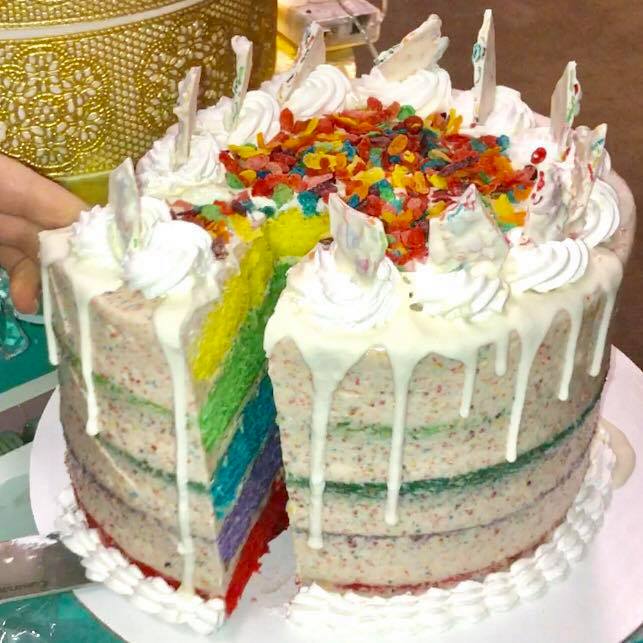
You are a GUI agent. You are given a task and a screenshot of the screen. Output one action in this format:
    pyautogui.click(x=<x>, y=<y>)
    Task: Click on the cord
    Image resolution: width=643 pixels, height=643 pixels.
    Given the screenshot: What is the action you would take?
    pyautogui.click(x=370, y=44)